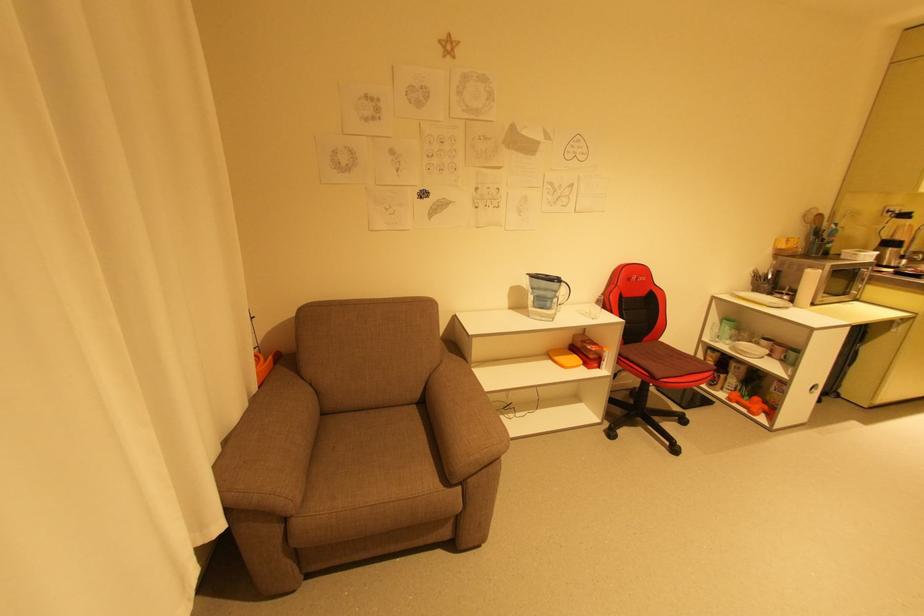
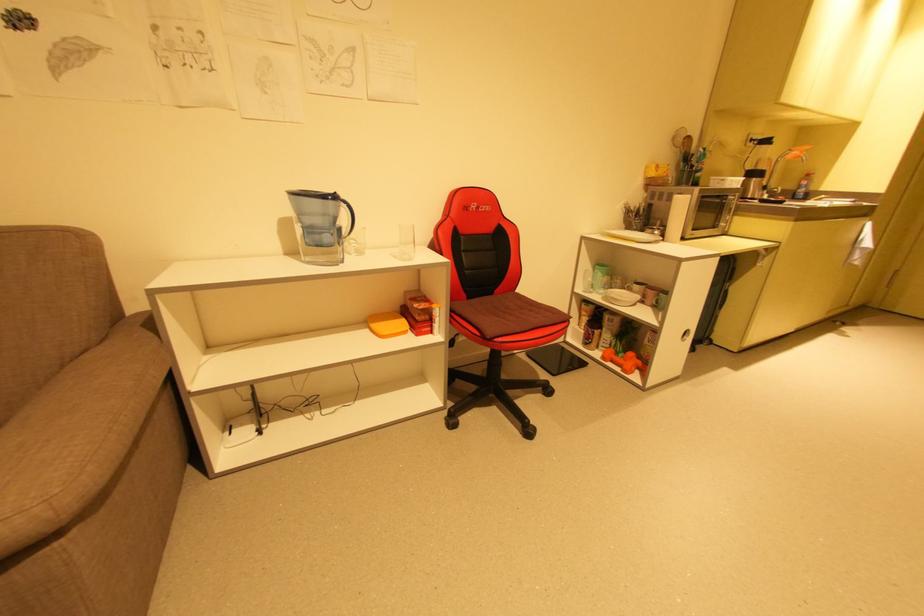
Question: I am providing you with two images of the same scene from different viewpoints. Which of the following objects are not visible in image2?

Choices:
 (A) orange dumbbell
 (B) water pitcher handle
 (C) orange plastic container
 (D) none of these

Answer: (D)